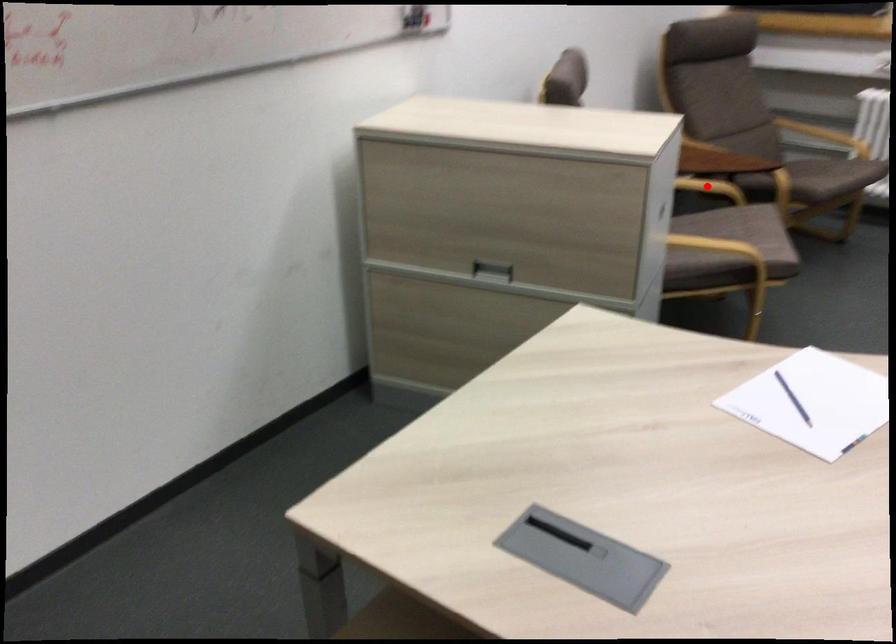
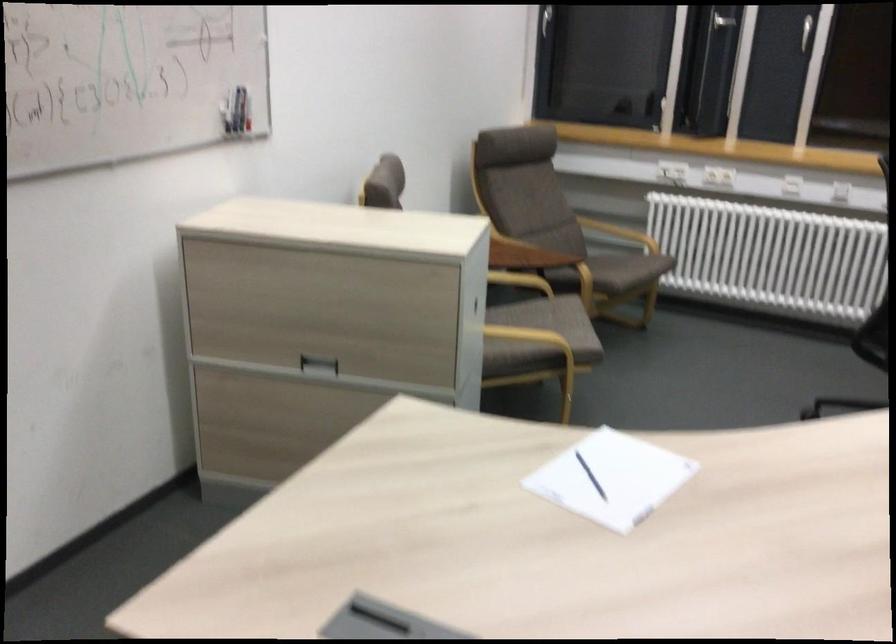
Find the pixel in the second image that matches the highlighted location in the first image.

(520, 279)